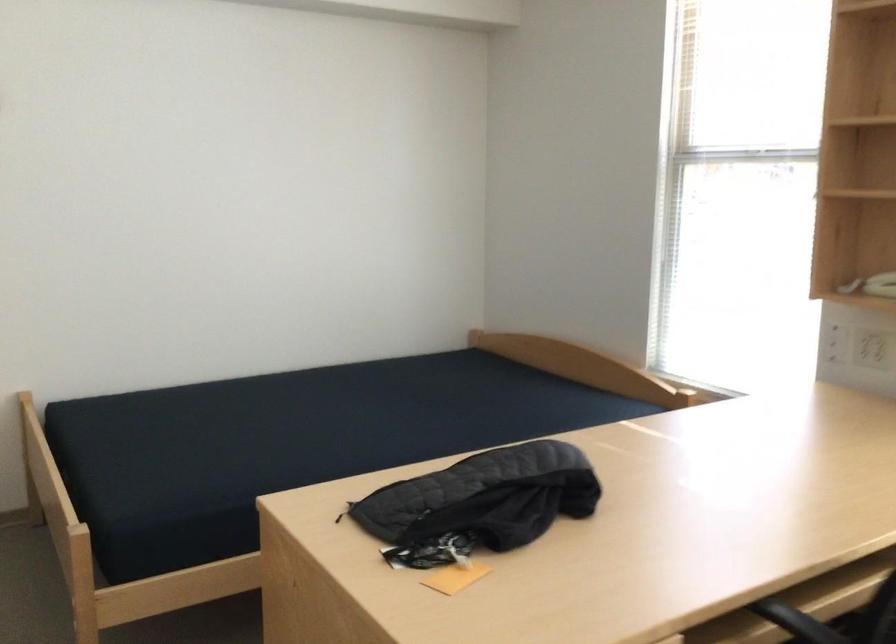
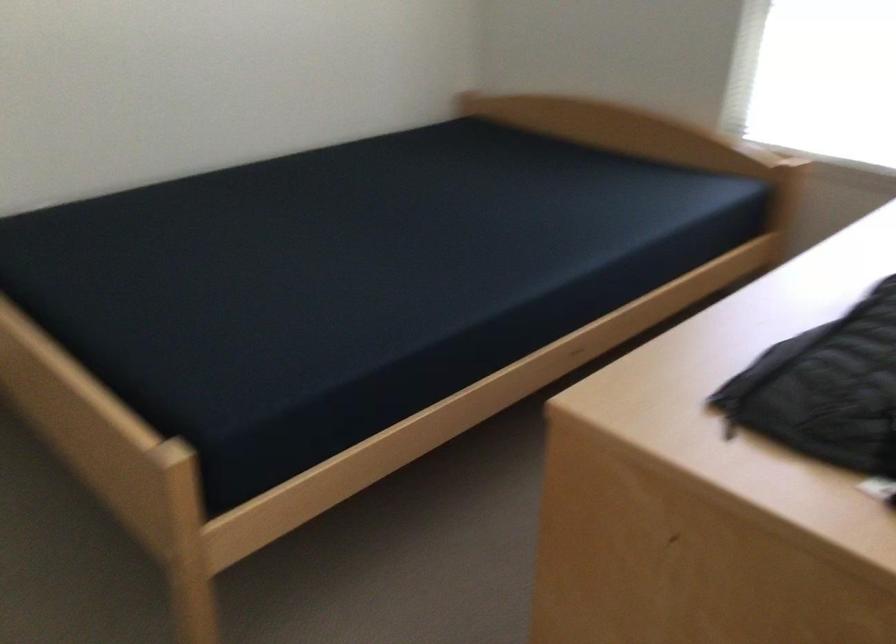
From the picture: The images are taken continuously from a first-person perspective. In which direction are you moving?

The movement direction of the cameraman is left, forward.